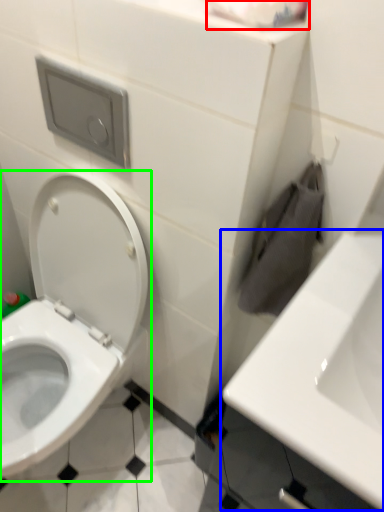
Question: Estimate the real-world distances between objects in this image. Which object is farther from toilet paper (highlighted by a red box), sink (highlighted by a blue box) or toilet (highlighted by a green box)?

Choices:
 (A) sink
 (B) toilet

Answer: (B)